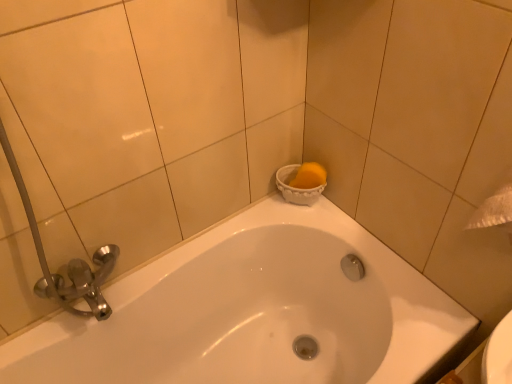
The height and width of the screenshot is (384, 512). What do you see at coordinates (254, 311) in the screenshot?
I see `white glossy bathtub at upper center` at bounding box center [254, 311].

Identify the location of white glossy bathtub at upper center. (254, 311).

The width and height of the screenshot is (512, 384). I want to click on yellow sponge at upper right, so click(x=296, y=187).

The width and height of the screenshot is (512, 384). Describe the element at coordinates (296, 187) in the screenshot. I see `yellow sponge at upper right` at that location.

Where is `white glossy bathtub at upper center`? The height and width of the screenshot is (384, 512). white glossy bathtub at upper center is located at coordinates (254, 311).

Is white glossy bathtub at upper center to the left or to the right of yellow sponge at upper right in the image?

In the image, white glossy bathtub at upper center appears on the left side of yellow sponge at upper right.

Considering the relative positions of white glossy bathtub at upper center and yellow sponge at upper right in the image provided, is white glossy bathtub at upper center in front of yellow sponge at upper right?

Yes, the depth of white glossy bathtub at upper center is less than that of yellow sponge at upper right.

Is point (122, 311) behind point (314, 188)?

No, it is in front of (314, 188).

From the image's perspective, would you say white glossy bathtub at upper center is shown under yellow sponge at upper right?

Correct, white glossy bathtub at upper center appears lower than yellow sponge at upper right in the image.

From a real-world perspective, is white glossy bathtub at upper center positioned above or below yellow sponge at upper right?

white glossy bathtub at upper center is below yellow sponge at upper right.

Is white glossy bathtub at upper center wider or thinner than yellow sponge at upper right?

white glossy bathtub at upper center is wider than yellow sponge at upper right.

Is white glossy bathtub at upper center taller or shorter than yellow sponge at upper right?

Clearly, white glossy bathtub at upper center is taller compared to yellow sponge at upper right.

Considering the relative sizes of white glossy bathtub at upper center and yellow sponge at upper right in the image provided, is white glossy bathtub at upper center smaller than yellow sponge at upper right?

No, white glossy bathtub at upper center is not smaller than yellow sponge at upper right.

Is white glossy bathtub at upper center inside the boundaries of yellow sponge at upper right, or outside?

white glossy bathtub at upper center is not enclosed by yellow sponge at upper right.

Is white glossy bathtub at upper center touching yellow sponge at upper right?

They are not placed beside each other.

Is white glossy bathtub at upper center oriented towards yellow sponge at upper right?

No.

Locate an element on the screen. The width and height of the screenshot is (512, 384). basin above the white glossy bathtub at upper center (from the image's perspective) is located at coordinates (296, 187).

Considering the positions of objects yellow sponge at upper right and white glossy bathtub at upper center in the image provided, who is more to the right, yellow sponge at upper right or white glossy bathtub at upper center?

yellow sponge at upper right.

Is yellow sponge at upper right in front of or behind white glossy bathtub at upper center in the image?

yellow sponge at upper right is positioned farther from the viewer than white glossy bathtub at upper center.

Which is further, (289, 172) or (106, 292)?

Positioned behind is point (289, 172).

From the image's perspective, would you say yellow sponge at upper right is shown under white glossy bathtub at upper center?

No, from the image's perspective, yellow sponge at upper right is not beneath white glossy bathtub at upper center.

From a real-world perspective, relative to white glossy bathtub at upper center, is yellow sponge at upper right vertically above or below?

Clearly, from a real-world perspective, yellow sponge at upper right is above white glossy bathtub at upper center.

Can you confirm if yellow sponge at upper right is wider than white glossy bathtub at upper center?

Incorrect, the width of yellow sponge at upper right does not surpass that of white glossy bathtub at upper center.

Considering the relative sizes of yellow sponge at upper right and white glossy bathtub at upper center in the image provided, is yellow sponge at upper right shorter than white glossy bathtub at upper center?

Yes, yellow sponge at upper right is shorter than white glossy bathtub at upper center.

In terms of size, does yellow sponge at upper right appear bigger or smaller than white glossy bathtub at upper center?

yellow sponge at upper right is smaller than white glossy bathtub at upper center.

Is yellow sponge at upper right not within white glossy bathtub at upper center?

Yes, yellow sponge at upper right is located beyond the bounds of white glossy bathtub at upper center.

Would you say yellow sponge at upper right is a long distance from white glossy bathtub at upper center?

yellow sponge at upper right is actually quite close to white glossy bathtub at upper center.

Is yellow sponge at upper right oriented away from white glossy bathtub at upper center?

No, yellow sponge at upper right's orientation is not away from white glossy bathtub at upper center.

How many degrees apart are the facing directions of yellow sponge at upper right and white glossy bathtub at upper center?

The angle between the facing direction of yellow sponge at upper right and the facing direction of white glossy bathtub at upper center is 0.72 degrees.

Where is `basin lying behind the white glossy bathtub at upper center`? Image resolution: width=512 pixels, height=384 pixels. basin lying behind the white glossy bathtub at upper center is located at coordinates (296, 187).

Locate an element on the screen. The width and height of the screenshot is (512, 384). basin above the white glossy bathtub at upper center (from the image's perspective) is located at coordinates (296, 187).

Where is `bathtub on the left of yellow sponge at upper right`? The image size is (512, 384). bathtub on the left of yellow sponge at upper right is located at coordinates (254, 311).